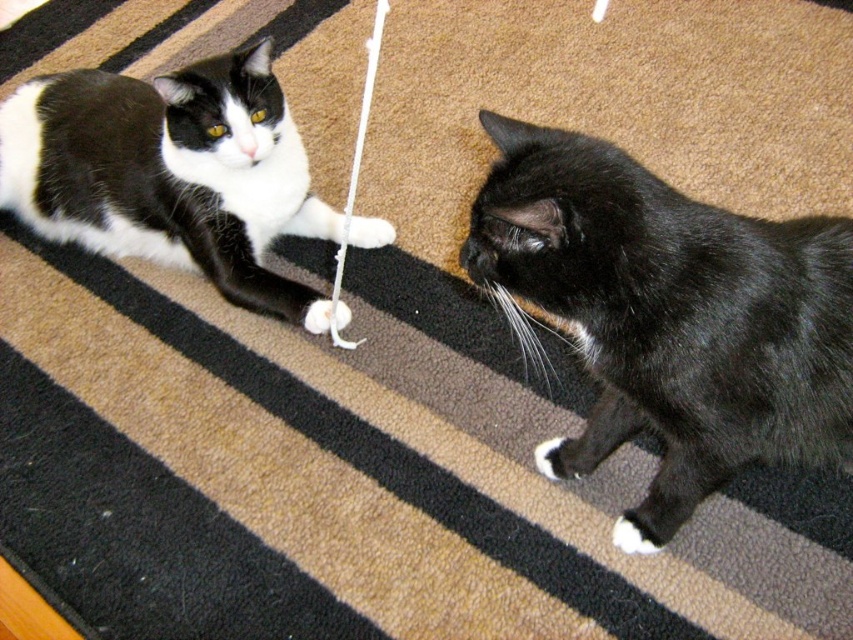
You are a cat owner trying to retrieve the white fuzzy string at center. The black matte fur cat at upper left is blocking your path. Can you reach the string without moving the cat?

The white fuzzy string at center is behind the black matte fur cat at upper left, so you can reach it without moving the cat by going around the cat or approaching from the side where the string is located.

You are standing in front of the image and want to know how far the point at coordinates point (639,538) is from you. Can you determine the distance?

The point (639,538) is 4.38 feet from the viewer.